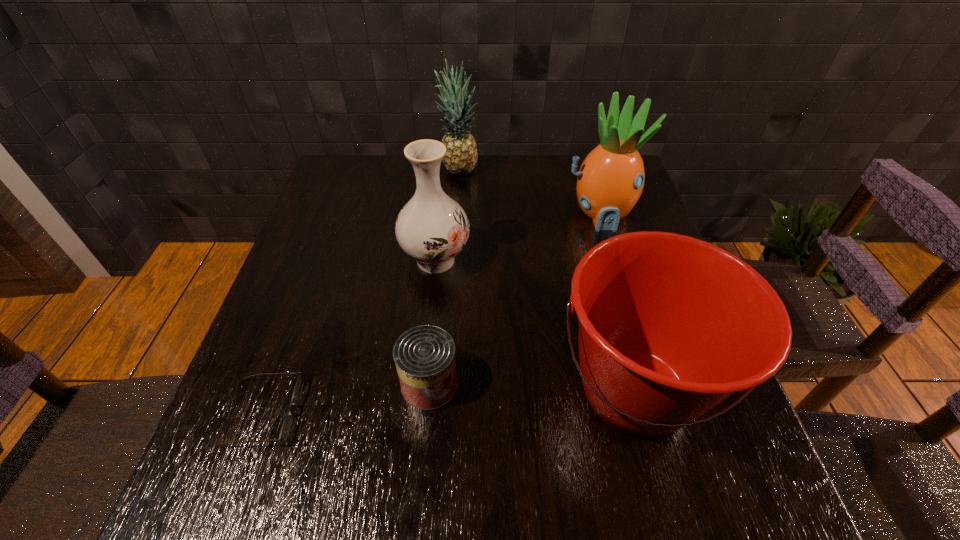
Identify the location of free space between the vase and the can. The width and height of the screenshot is (960, 540). (433, 322).

Find the location of a particular element. This screenshot has height=540, width=960. blank region between the fourth nearest object and the second shortest object is located at coordinates (433, 322).

You are a GUI agent. You are given a task and a screenshot of the screen. Output one action in this format:
    pyautogui.click(x=<x>, y=<y>)
    Task: Click on the unoccupied position between the nearer pineapple and the spectacles
    The width and height of the screenshot is (960, 540).
    Given the screenshot: What is the action you would take?
    pyautogui.click(x=432, y=313)

Where is `free spot between the right pineapple and the shortest object`? This screenshot has width=960, height=540. free spot between the right pineapple and the shortest object is located at coordinates 432,313.

Locate an element on the screen. The height and width of the screenshot is (540, 960). free space between the vase and the second farthest object is located at coordinates (517, 237).

Locate which object is the fifth closest to the third farthest object. Please provide its 2D coordinates. Your answer should be formatted as a tuple, i.e. [(x, y)], where the tuple contains the x and y coordinates of a point satisfying the conditions above.

[(287, 422)]

The height and width of the screenshot is (540, 960). Identify the location of object that is the nearest to the second shortest object. (670, 326).

Locate an element on the screen. The width and height of the screenshot is (960, 540). free space that satisfies the following two spatial constraints: 1. at the entrance of the right pineapple; 2. on the front-facing side of the spectacles is located at coordinates (660, 412).